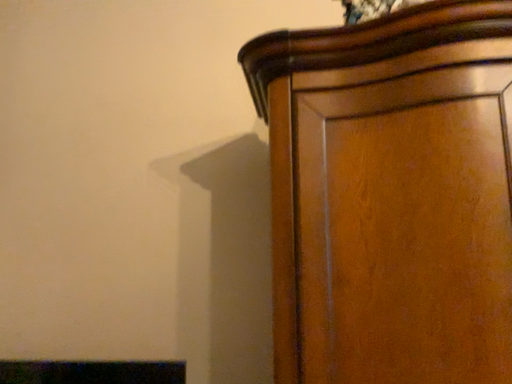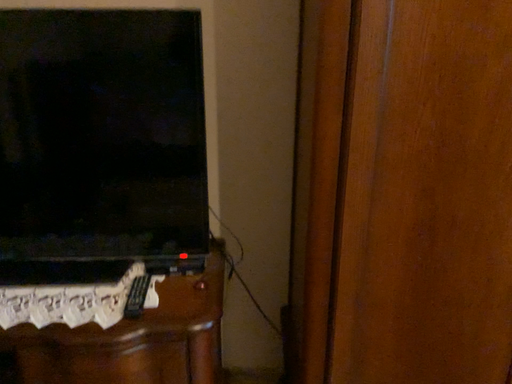
Question: How did the camera likely rotate when shooting the video?

Choices:
 (A) rotated upward
 (B) rotated downward

Answer: (B)